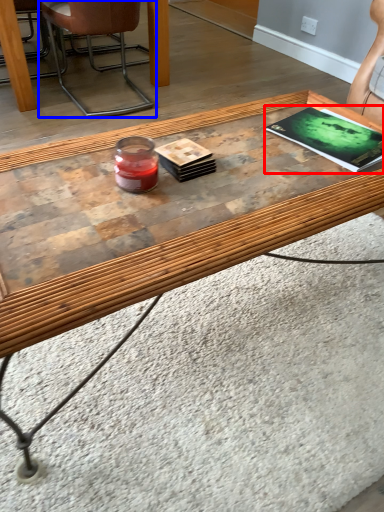
Question: Which point is closer to the camera, magazine (highlighted by a red box) or chair (highlighted by a blue box)?

Choices:
 (A) magazine
 (B) chair

Answer: (A)